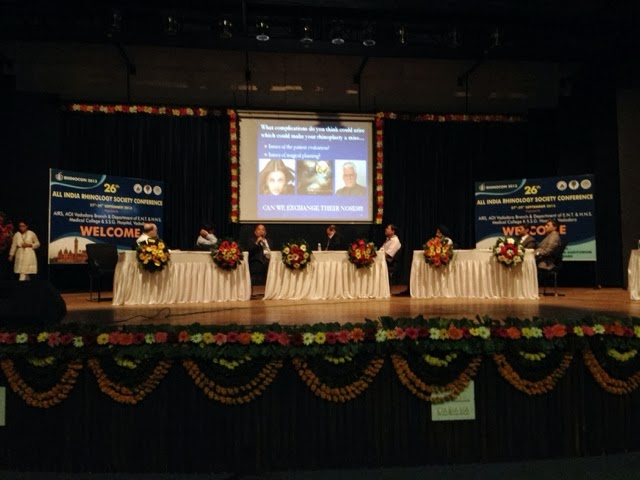
You are a GUI agent. You are given a task and a screenshot of the screen. Output one action in this format:
    pyautogui.click(x=<x>, y=<y>)
    Task: Click on the tablecloth
    This screenshot has height=480, width=640.
    Given the screenshot: What is the action you would take?
    pyautogui.click(x=633, y=277), pyautogui.click(x=450, y=282), pyautogui.click(x=324, y=281), pyautogui.click(x=200, y=282)